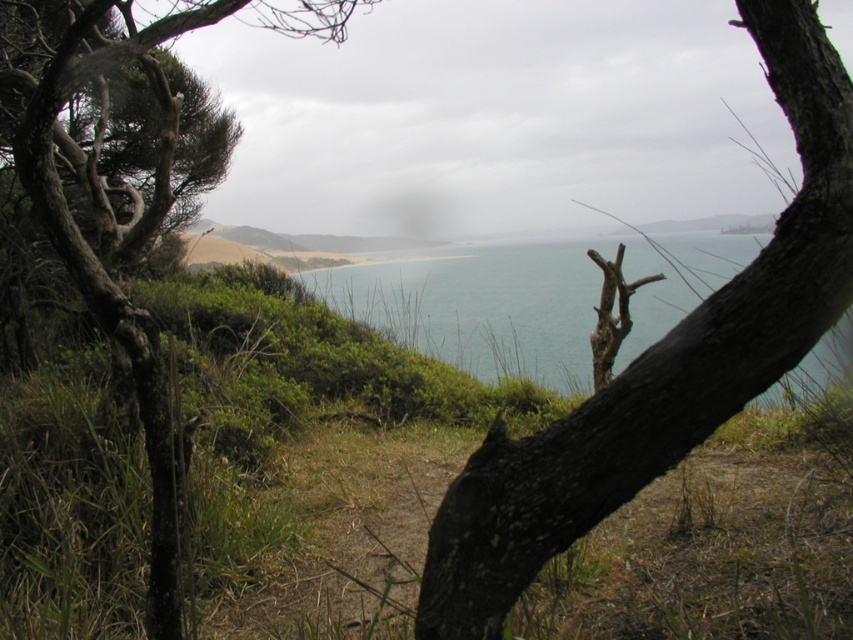
Question: Is blue water at center in front of brown rough bark tree at left?

Choices:
 (A) no
 (B) yes

Answer: (A)

Question: Can you confirm if dark brown bark tree at center is wider than brown rough bark tree at left?

Choices:
 (A) yes
 (B) no

Answer: (B)

Question: Among these objects, which one is nearest to the camera?

Choices:
 (A) brown rough bark tree at left
 (B) blue water at center

Answer: (A)

Question: Which point is farther to the camera?

Choices:
 (A) brown rough bark tree at left
 (B) blue water at center
 (C) dark brown bark tree at center

Answer: (B)

Question: Does dark brown bark tree at center have a larger size compared to blue water at center?

Choices:
 (A) yes
 (B) no

Answer: (A)

Question: Which point is farther to the camera?

Choices:
 (A) blue water at center
 (B) dark brown bark tree at center
 (C) brown rough bark tree at left

Answer: (A)